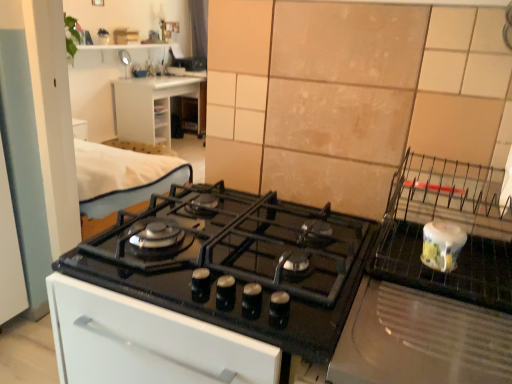
The height and width of the screenshot is (384, 512). Describe the element at coordinates (489, 31) in the screenshot. I see `beige tile at upper right` at that location.

You are a GUI agent. You are given a task and a screenshot of the screen. Output one action in this format:
    pyautogui.click(x=<x>, y=<y>)
    Task: Click on the white plastic drawer at upper left
    This screenshot has width=512, height=384.
    Given the screenshot: What is the action you would take?
    pyautogui.click(x=154, y=106)

What do you see at coordinates (420, 340) in the screenshot?
I see `white ceramic jar at right` at bounding box center [420, 340].

The image size is (512, 384). Identify the location of beige tile at upper right. (489, 31).

Can you tell me how much white plastic drawer at upper left and black glass gas stove at center differ in facing direction?

90.8 degrees separate the facing orientations of white plastic drawer at upper left and black glass gas stove at center.

Can you confirm if white plastic drawer at upper left is positioned to the left of black glass gas stove at center?

Indeed, white plastic drawer at upper left is positioned on the left side of black glass gas stove at center.

At what (x,y) coordinates should I click in order to perform the action: click on counter top that is behind the black glass gas stove at center. Please return your answer as a coordinate pair (x, y). The width and height of the screenshot is (512, 384). Looking at the image, I should click on (154, 106).

Considering the sizes of objects white plastic drawer at upper left and black glass gas stove at center in the image provided, who is smaller, white plastic drawer at upper left or black glass gas stove at center?

Smaller between the two is black glass gas stove at center.

Which object is closer to the camera taking this photo, beige tile at upper right or white plastic drawer at upper left?

beige tile at upper right is more forward.

From a real-world perspective, is beige tile at upper right under white plastic drawer at upper left?

No, from a real-world perspective, beige tile at upper right is not under white plastic drawer at upper left.

Considering the relative sizes of beige tile at upper right and white plastic drawer at upper left in the image provided, is beige tile at upper right wider than white plastic drawer at upper left?

In fact, beige tile at upper right might be narrower than white plastic drawer at upper left.

Is beige tile at upper right to the right of white plastic drawer at upper left from the viewer's perspective?

Yes, beige tile at upper right is to the right of white plastic drawer at upper left.

Is point (356, 344) closer to camera compared to point (484, 20)?

Yes, point (356, 344) is closer to viewer.

The image size is (512, 384). In order to click on tile above the white ceramic jar at right (from the image's perspective) in this screenshot , I will do `click(489, 31)`.

Is white ceramic jar at right oriented towards beige tile at upper right?

No, white ceramic jar at right does not turn towards beige tile at upper right.

Is white ceramic jar at right further to camera compared to beige tile at upper right?

No, white ceramic jar at right is closer to the camera.

Is white plastic drawer at upper left touching white ceramic jar at right?

They are not placed beside each other.

Could white ceramic jar at right be considered to be inside white plastic drawer at upper left?

No, white ceramic jar at right is not surrounded by white plastic drawer at upper left.

Is white plastic drawer at upper left aimed at white ceramic jar at right?

No, white plastic drawer at upper left is not turned towards white ceramic jar at right.

Between point (148, 106) and point (400, 356), which one is positioned behind?

The point (148, 106) is farther.

Where is `kitchen appliance to the right of white plastic drawer at upper left`? kitchen appliance to the right of white plastic drawer at upper left is located at coordinates (442, 245).

Based on the photo, is porcelain yellow jar at right oriented away from white plastic drawer at upper left?

porcelain yellow jar at right is not turned away from white plastic drawer at upper left.

Between porcelain yellow jar at right and white plastic drawer at upper left, which one has less height?

With less height is porcelain yellow jar at right.

Based on their positions, is porcelain yellow jar at right located to the left or right of white plastic drawer at upper left?

From the image, it's evident that porcelain yellow jar at right is to the right of white plastic drawer at upper left.

Between white plastic drawer at upper left and porcelain yellow jar at right, which one has less height?

With less height is porcelain yellow jar at right.

Is porcelain yellow jar at right completely or partially inside white plastic drawer at upper left?

No, porcelain yellow jar at right is not a part of white plastic drawer at upper left.

Are white plastic drawer at upper left and porcelain yellow jar at right located far from each other?

Yes, white plastic drawer at upper left and porcelain yellow jar at right are located far from each other.

Looking at this image, does porcelain yellow jar at right have a lesser width compared to white ceramic jar at right?

Correct, the width of porcelain yellow jar at right is less than that of white ceramic jar at right.

Which is in front, point (437, 254) or point (421, 352)?

The point (421, 352) is closer.

Does porcelain yellow jar at right contain white ceramic jar at right?

No, white ceramic jar at right is not surrounded by porcelain yellow jar at right.

Where is `counter top that appears on the left of black glass gas stove at center`? counter top that appears on the left of black glass gas stove at center is located at coordinates (154, 106).

Locate an element on the screen. tile in front of the white plastic drawer at upper left is located at coordinates (489, 31).

Considering their positions, is porcelain yellow jar at right positioned closer to white ceramic jar at right than beige tile at upper right?

porcelain yellow jar at right lies closer to white ceramic jar at right than the other object.

Which object lies further to the anchor point white plastic drawer at upper left, white ceramic jar at right or black glass gas stove at center?

Among the two, white ceramic jar at right is located further to white plastic drawer at upper left.

Estimate the real-world distances between objects in this image. Which object is further from beige tile at upper right, white plastic drawer at upper left or white ceramic jar at right?

white plastic drawer at upper left lies further to beige tile at upper right than the other object.

From the image, which object appears to be farther from beige tile at upper right, porcelain yellow jar at right or white ceramic jar at right?

white ceramic jar at right.

Looking at the image, which one is located further to white plastic drawer at upper left, beige tile at upper right or porcelain yellow jar at right?

beige tile at upper right.

Considering their positions, is porcelain yellow jar at right positioned closer to beige tile at upper right than black glass gas stove at center?

porcelain yellow jar at right is closer to beige tile at upper right.

Based on their spatial positions, is black glass gas stove at center or beige tile at upper right closer to white plastic drawer at upper left?

black glass gas stove at center is positioned closer to the anchor white plastic drawer at upper left.

When comparing their distances from white ceramic jar at right, does beige tile at upper right or white plastic drawer at upper left seem further?

Based on the image, white plastic drawer at upper left appears to be further to white ceramic jar at right.

Locate an element on the screen. The height and width of the screenshot is (384, 512). kitchen appliance between beige tile at upper right and white ceramic jar at right vertically is located at coordinates (442, 245).

This screenshot has height=384, width=512. I want to click on kitchen appliance situated between black glass gas stove at center and beige tile at upper right from left to right, so click(x=442, y=245).

The image size is (512, 384). In order to click on kitchen appliance between white ceramic jar at right and white plastic drawer at upper left in the front-back direction in this screenshot , I will do `click(442, 245)`.

Where is `home appliance between black glass gas stove at center and porcelain yellow jar at right`? home appliance between black glass gas stove at center and porcelain yellow jar at right is located at coordinates (420, 340).